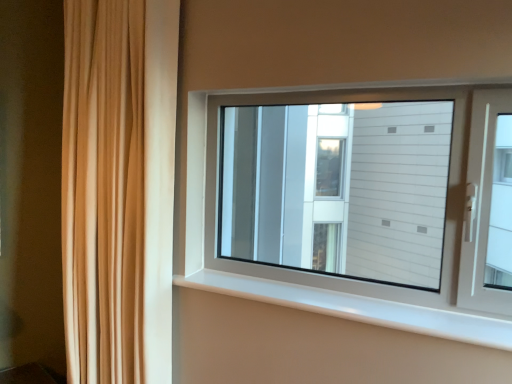
Image resolution: width=512 pixels, height=384 pixels. In order to click on free location above white plastic window sill at center (from a real-world perspective) in this screenshot , I will do `click(365, 299)`.